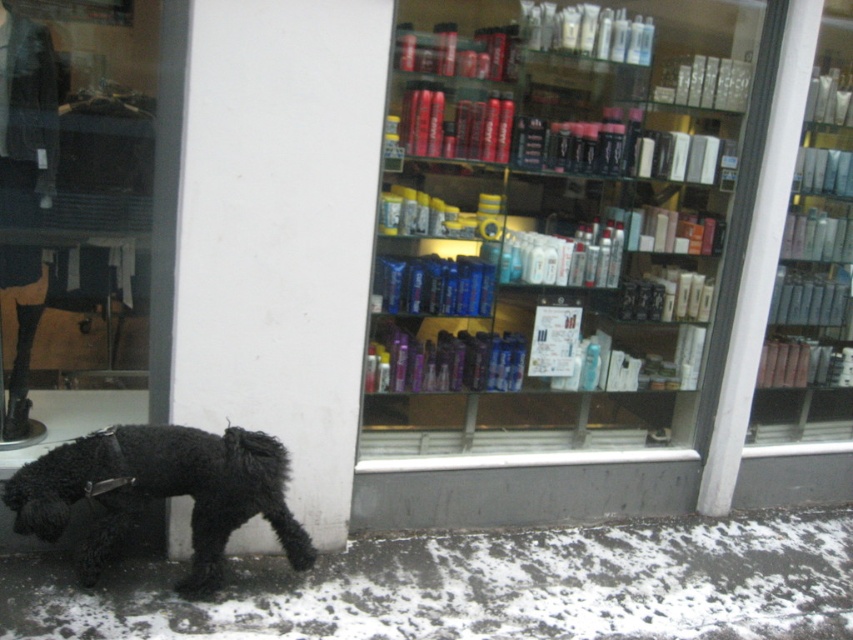
Is translucent glass shelves at center further to the viewer compared to black fuzzy dog at lower left?

Answer: Yes, it is behind black fuzzy dog at lower left.

Consider the image. Does translucent glass shelves at center have a smaller size compared to black fuzzy dog at lower left?

Actually, translucent glass shelves at center might be larger than black fuzzy dog at lower left.

This screenshot has width=853, height=640. What do you see at coordinates (553, 225) in the screenshot? I see `translucent glass shelves at center` at bounding box center [553, 225].

Where is `translucent glass shelves at center`? translucent glass shelves at center is located at coordinates (553, 225).